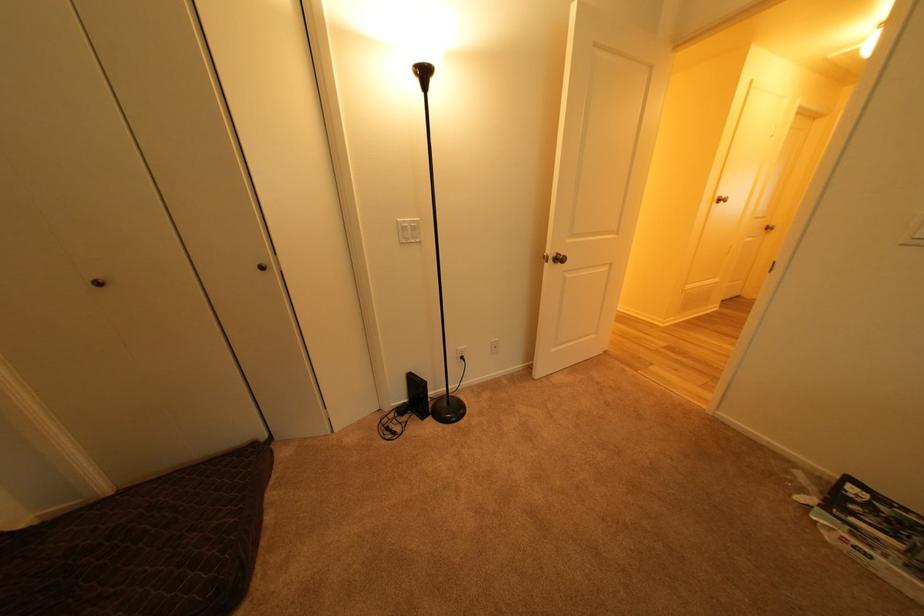
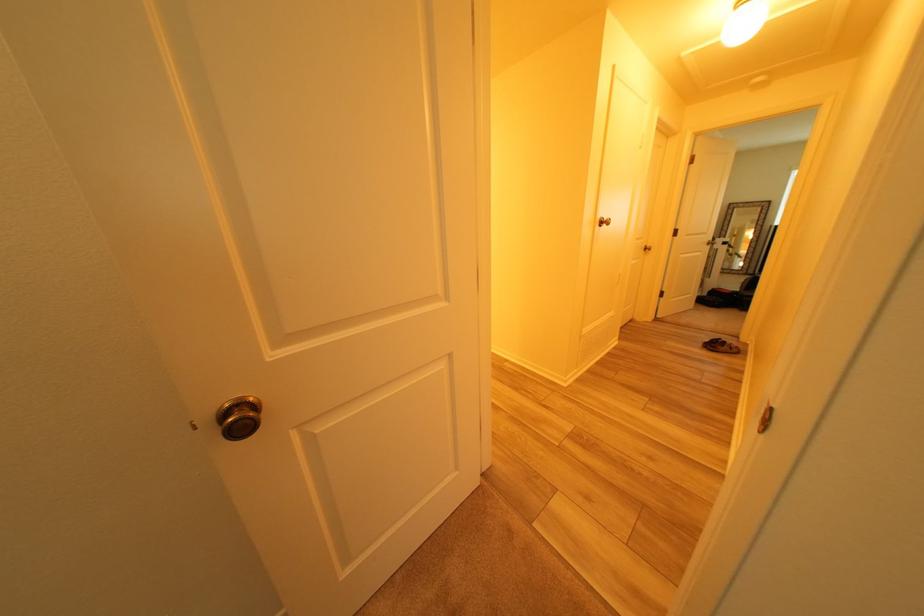
The images are taken continuously from a first-person perspective. In which direction are you moving?

The movement direction of the cameraman is right, forward.